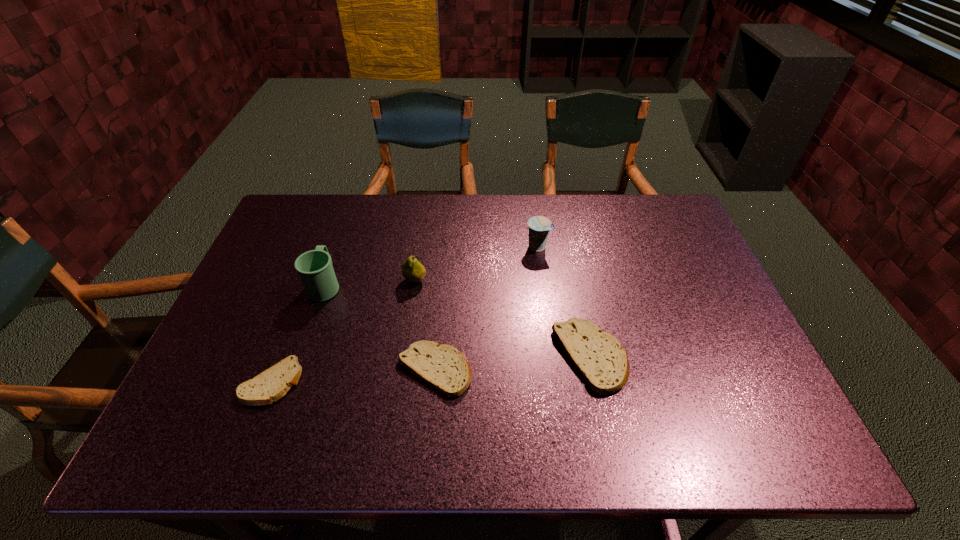
The image size is (960, 540). What are the coordinates of `vacant region between the pear and the fourth tallest object` in the screenshot? It's located at (503, 319).

The image size is (960, 540). I want to click on free area in between the tallest pita bread and the pear, so click(503, 319).

This screenshot has height=540, width=960. Identify the location of vacant space in between the yogurt and the second shortest object. (487, 308).

The image size is (960, 540). Identify the location of unoccupied position between the yogurt and the pear. (476, 264).

Find the location of `object that is the fourth closest to the shortest object`. object that is the fourth closest to the shortest object is located at coordinates (599, 358).

At what (x,y) coordinates should I click in order to perform the action: click on object that can be found as the closest to the shortest pita bread. Please return your answer as a coordinate pair (x, y). Looking at the image, I should click on (314, 267).

Locate an element on the screen. The image size is (960, 540). the third closest pita bread to the pear is located at coordinates (599, 358).

Find the location of a particular element. The image size is (960, 540). the second closest pita bread relative to the third shortest object is located at coordinates coord(272,384).

Image resolution: width=960 pixels, height=540 pixels. In order to click on vacant space that satisfies the following two spatial constraints: 1. on the side of the pear with the handle; 2. on the right side of the mug in this screenshot , I will do `click(326, 280)`.

This screenshot has width=960, height=540. Identify the location of blank area in the image that satisfies the following two spatial constraints: 1. on the back side of the fourth tallest object; 2. on the left side of the fifth tallest object. (436, 357).